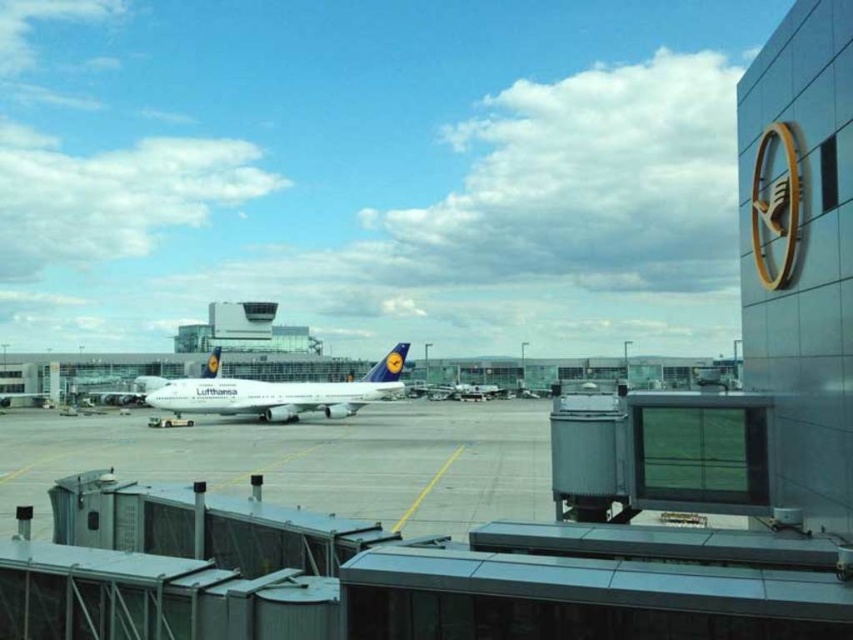
Question: Where is smooth concrete tarmac at center located in relation to metallic silver airplane at center in the image?

Choices:
 (A) right
 (B) left

Answer: (B)

Question: Can you confirm if smooth concrete tarmac at center is bigger than white glossy airplane at center?

Choices:
 (A) yes
 (B) no

Answer: (A)

Question: Which of the following is the closest to the observer?

Choices:
 (A) metallic silver airplane at center
 (B) white glossy airplane at center
 (C) smooth concrete tarmac at center

Answer: (C)

Question: Which point is farther to the camera?

Choices:
 (A) metallic silver airplane at center
 (B) white glossy airplane at center

Answer: (A)

Question: Estimate the real-world distances between objects in this image. Which object is closer to the metallic silver airplane at center?

Choices:
 (A) white glossy airplane at center
 (B) smooth concrete tarmac at center

Answer: (A)

Question: Is smooth concrete tarmac at center above metallic silver airplane at center?

Choices:
 (A) no
 (B) yes

Answer: (B)